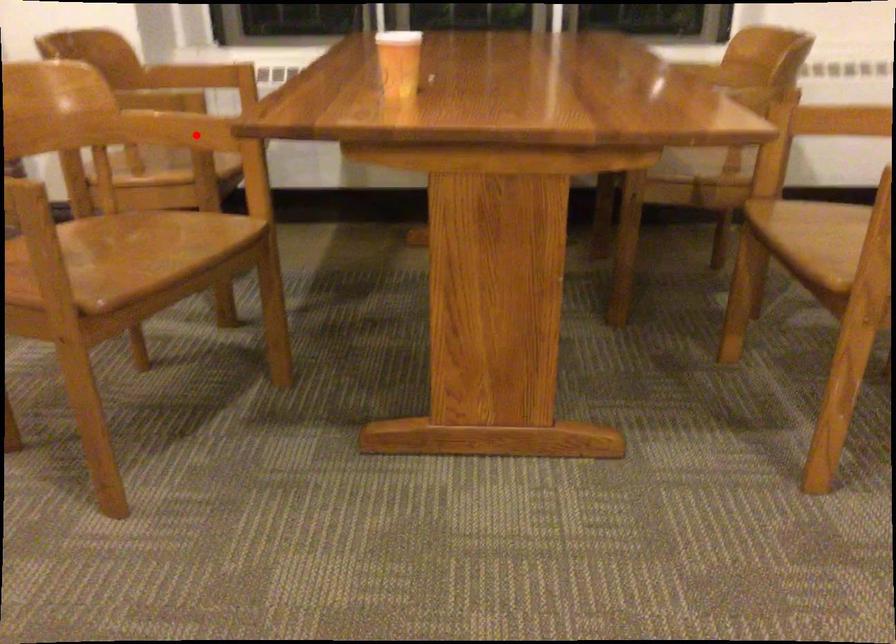
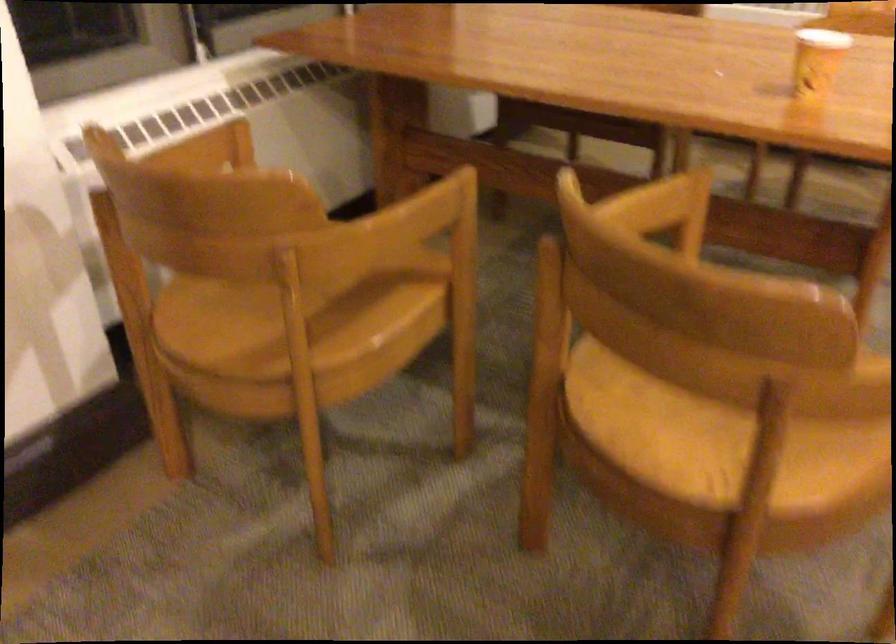
Question: I am providing you with two images of the same scene from different viewpoints. A red point is shown in image1. For the corresponding object point in image2, is it positioned nearer or farther from the camera?

Choices:
 (A) Nearer
 (B) Farther

Answer: (A)